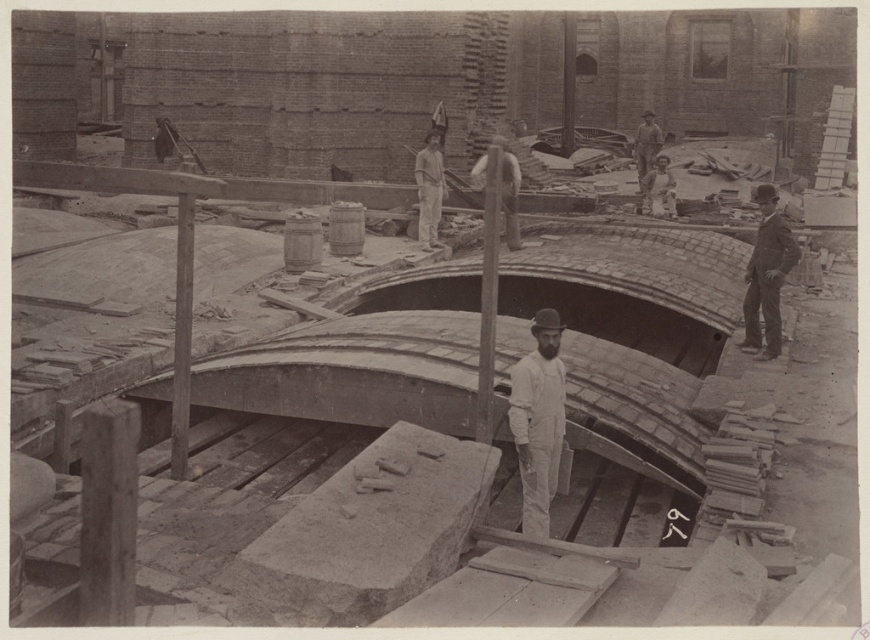
Question: From the image, what is the correct spatial relationship of smooth wooden pole at center in relation to smooth brown hat at upper right?

Choices:
 (A) above
 (B) below

Answer: (B)

Question: Which point is closer to the camera taking this photo?

Choices:
 (A) (430, 180)
 (B) (503, 218)

Answer: (A)

Question: Which of these objects is positioned closest to the smooth brown hat at upper right?

Choices:
 (A) smooth wooden pole at center
 (B) smooth black suit at right
 (C) white cotton overalls at center

Answer: (A)

Question: Is smooth white shirt at center behind light brown wooden crate at upper right?

Choices:
 (A) yes
 (B) no

Answer: (B)

Question: Does smooth black suit at right have a lesser width compared to smooth brown hat at upper right?

Choices:
 (A) no
 (B) yes

Answer: (B)

Question: Which object is farther from the camera taking this photo?

Choices:
 (A) smooth brown hat at upper right
 (B) smooth wooden pole at center
 (C) smooth black suit at right
 (D) light brown wooden crate at upper right

Answer: (A)